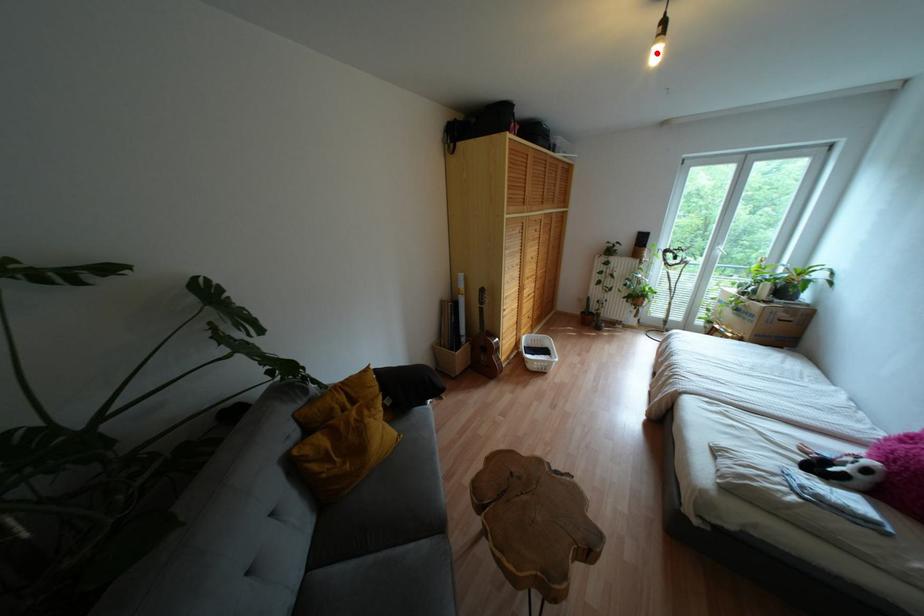
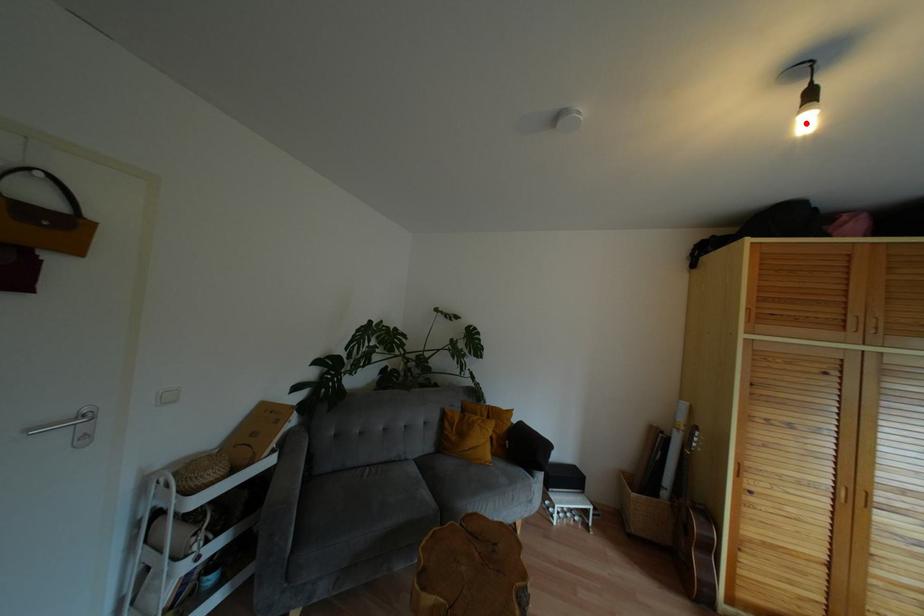
I am providing you with two images of the same scene from different viewpoints. A red point is marked on the first image and another point is marked on the second image. Is the red point in image1 aligned with the point shown in image2?

Yes